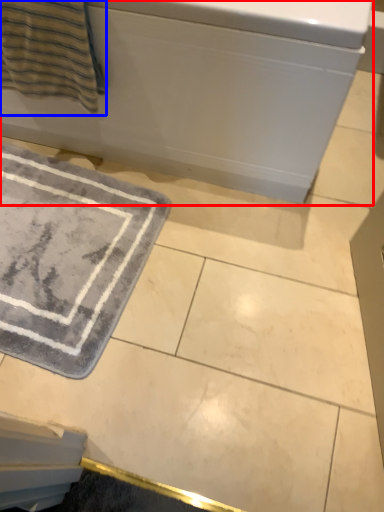
Question: Which of the following is the closest to the observer, bath (highlighted by a red box) or beach towel (highlighted by a blue box)?

Choices:
 (A) bath
 (B) beach towel

Answer: (A)